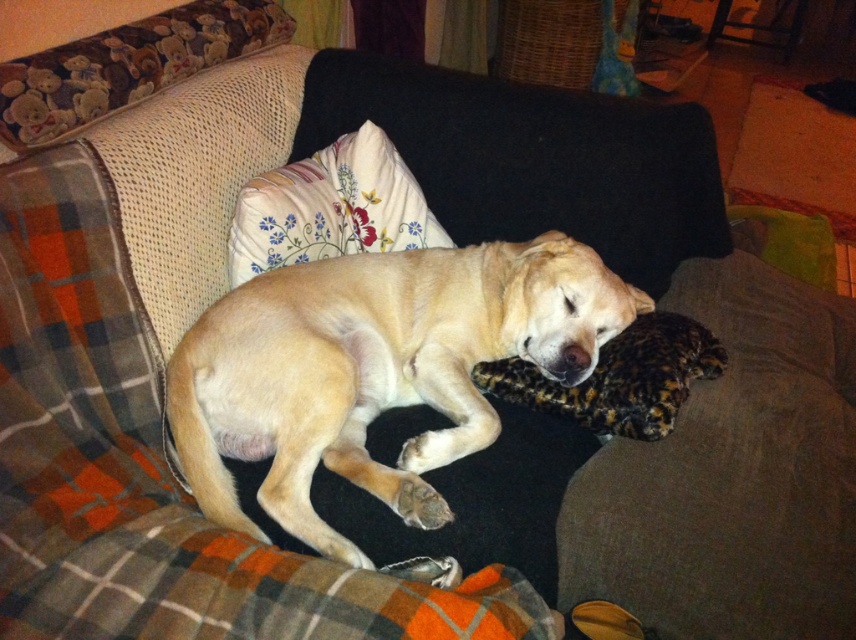
You are a photographer setting up a shoot in the living room. You need to position a camera on a tripod so that it can capture both the golden fur dog at center and the brown fuzzy pillow at center in the same frame. Based on their heights, which object should be placed closer to the camera to ensure both are visible without adjusting the tripod height?

The golden fur dog at center is taller than the brown fuzzy pillow at center. To ensure both are visible in the same frame without adjusting the tripod height, the brown fuzzy pillow at center should be placed closer to the camera. This way, the camera can be positioned to capture the taller dog in the background and the shorter pillow in the foreground without needing to change the height.

You are a dog owner who wants to place a new toy between the floral fabric pillow at upper center and the brown fuzzy pillow at center. Based on their positions, which pillow is closer to you so you can place the toy in front of it?

The floral fabric pillow at upper center is closer to you, so you should place the toy in front of it since it is nearer than the brown fuzzy pillow at center.

In the scene shown: You are a pet sitter and need to ensure the golden fur dog at center has enough space to move comfortably on the couch. Considering the floral fabric pillow at upper center is in the way, can the dog move freely without displacing the pillow?

The golden fur dog at center might be wider than floral fabric pillow at upper center, so the dog may not have enough space to move freely without displacing the pillow.